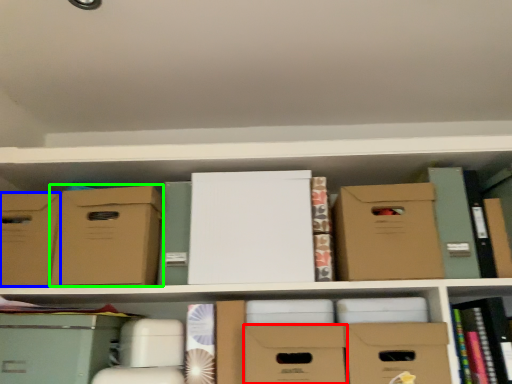
Question: Considering the real-world distances, which object is closest to storage box (highlighted by a red box)? storage box (highlighted by a blue box) or cardboard box (highlighted by a green box).

Choices:
 (A) storage box
 (B) cardboard box

Answer: (B)